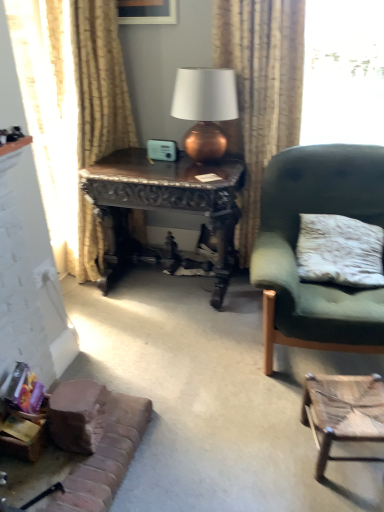
Question: Is velvet green armchair at right at the left side of wooden picture frame at upper center?

Choices:
 (A) yes
 (B) no

Answer: (B)

Question: Does velvet green armchair at right appear on the right side of wooden picture frame at upper center?

Choices:
 (A) yes
 (B) no

Answer: (A)

Question: Considering the relative sizes of velvet green armchair at right and wooden picture frame at upper center in the image provided, is velvet green armchair at right bigger than wooden picture frame at upper center?

Choices:
 (A) no
 (B) yes

Answer: (B)

Question: Is velvet green armchair at right wider than wooden picture frame at upper center?

Choices:
 (A) yes
 (B) no

Answer: (A)

Question: Is the depth of velvet green armchair at right greater than that of wooden picture frame at upper center?

Choices:
 (A) yes
 (B) no

Answer: (B)

Question: Can you confirm if velvet green armchair at right is smaller than wooden picture frame at upper center?

Choices:
 (A) yes
 (B) no

Answer: (B)

Question: Is dark wood carved desk at center taller than beige textured curtain at left, the first curtain in the left-to-right sequence?

Choices:
 (A) yes
 (B) no

Answer: (B)

Question: Does dark wood carved desk at center appear on the right side of beige textured curtain at left, the first curtain in the left-to-right sequence?

Choices:
 (A) no
 (B) yes

Answer: (B)

Question: Is dark wood carved desk at center next to beige textured curtain at left, placed as the second curtain when sorted from right to left, and touching it?

Choices:
 (A) yes
 (B) no

Answer: (B)

Question: Is dark wood carved desk at center aimed at beige textured curtain at left, placed as the second curtain when sorted from right to left?

Choices:
 (A) yes
 (B) no

Answer: (B)

Question: Is dark wood carved desk at center not near beige textured curtain at left, the first curtain in the left-to-right sequence?

Choices:
 (A) yes
 (B) no

Answer: (B)

Question: Is dark wood carved desk at center outside of beige textured curtain at left, placed as the second curtain when sorted from right to left?

Choices:
 (A) yes
 (B) no

Answer: (A)

Question: From a real-world perspective, is dark wood carved desk at center beneath velvet green armchair at right?

Choices:
 (A) yes
 (B) no

Answer: (A)